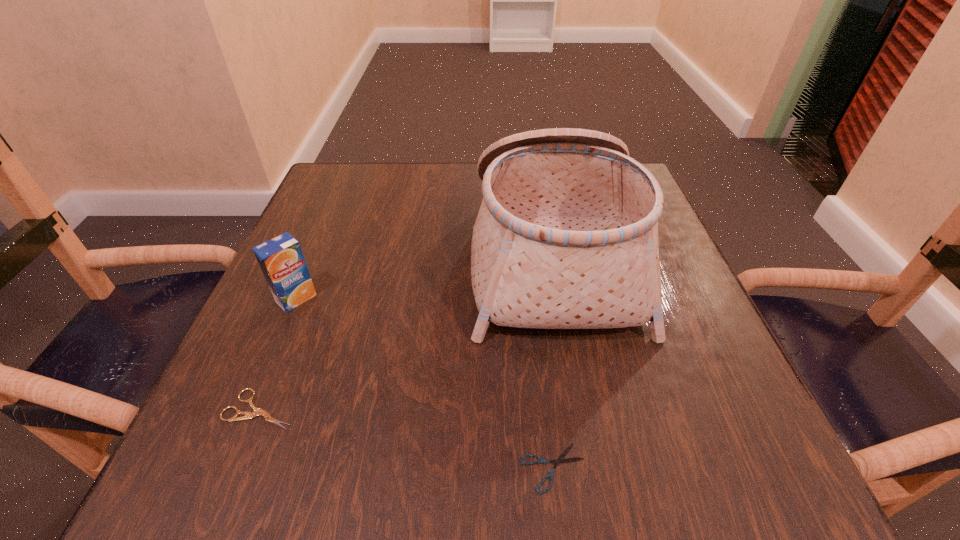
You are a GUI agent. You are given a task and a screenshot of the screen. Output one action in this format:
    pyautogui.click(x=<x>, y=<y>)
    Task: Click on the vacant space at the right edge of the desktop
    Image resolution: width=960 pixels, height=540 pixels.
    Given the screenshot: What is the action you would take?
    pyautogui.click(x=653, y=394)

In order to click on free spot at the far left corner of the desktop in this screenshot , I will do `click(387, 167)`.

Image resolution: width=960 pixels, height=540 pixels. What are the coordinates of `free point at the near left corner` in the screenshot? It's located at (224, 460).

I want to click on vacant space at the near right corner, so [708, 462].

At what (x,y) coordinates should I click in order to perform the action: click on vacant region between the nearer shears and the third shortest object. Please return your answer as a coordinate pair (x, y). Looking at the image, I should click on (424, 383).

Identify the location of free space that is in between the third shortest object and the taller shears. (278, 354).

Identify the location of vacant area that lies between the tallest object and the orange_juice. Image resolution: width=960 pixels, height=540 pixels. (424, 278).

The width and height of the screenshot is (960, 540). Identify the location of free point between the shorter shears and the basket. (553, 362).

Identify the location of empty space that is in between the third tallest object and the nearer shears. (407, 438).

The width and height of the screenshot is (960, 540). Identify the location of unoccupied position between the shortest object and the basket. (553, 362).